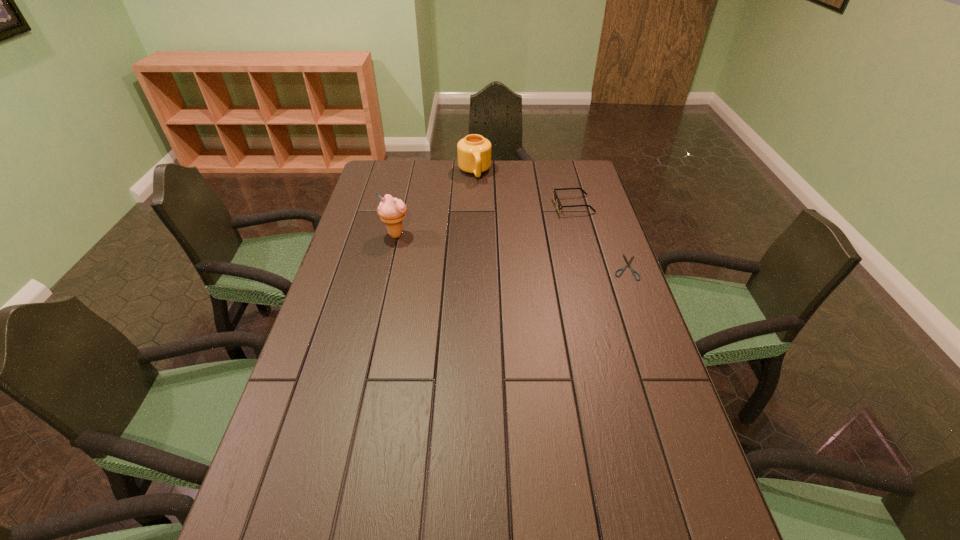
This screenshot has width=960, height=540. In the image, there is a desktop. Find the location of `vacant space at the far edge`. vacant space at the far edge is located at coordinates (499, 174).

I want to click on vacant space at the left edge of the desktop, so click(x=357, y=348).

What are the coordinates of `blank space at the right edge` in the screenshot? It's located at (613, 241).

Locate an element on the screen. This screenshot has width=960, height=540. vacant space at the far left corner is located at coordinates (375, 160).

In the image, there is a desktop. Where is `vacant region at the far right corner`? The height and width of the screenshot is (540, 960). vacant region at the far right corner is located at coordinates (571, 167).

Where is `free space at the near right corner`? free space at the near right corner is located at coordinates (x=708, y=518).

Where is `free space between the sunglasses and the second object from left to right`? The image size is (960, 540). free space between the sunglasses and the second object from left to right is located at coordinates (524, 189).

Identify the location of empty space that is in between the icecream and the third nearest object. This screenshot has height=540, width=960. (485, 220).

Where is `unoccupied area between the second farthest object and the leftmost object`? The image size is (960, 540). unoccupied area between the second farthest object and the leftmost object is located at coordinates (485, 220).

Locate an element on the screen. Image resolution: width=960 pixels, height=540 pixels. free point between the third object from right to left and the icecream is located at coordinates (435, 204).